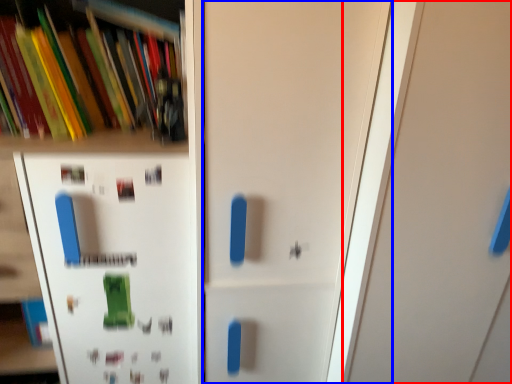
Question: Which object appears closest to the camera in this image, door (highlighted by a red box) or door (highlighted by a blue box)?

Choices:
 (A) door
 (B) door

Answer: (A)